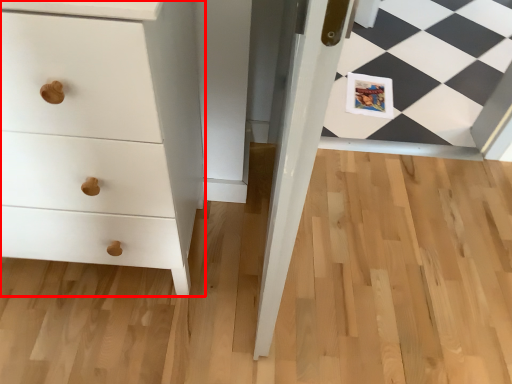
Question: From the image's perspective, what is the correct spatial positioning of chest of drawers (annotated by the red box) in reference to postcard?

Choices:
 (A) below
 (B) above

Answer: (A)